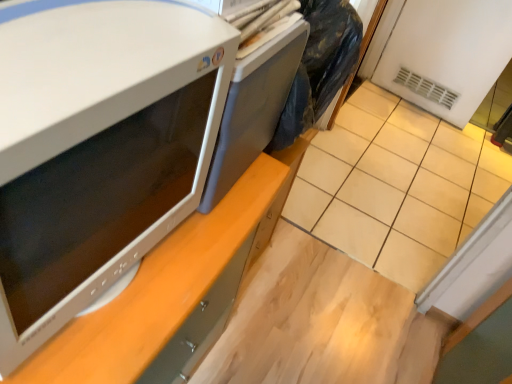
Question: From the image's perspective, is beige tile at lower right on white glossy microwave at left?

Choices:
 (A) no
 (B) yes

Answer: (B)

Question: Could white glossy microwave at left be considered to be inside beige tile at lower right?

Choices:
 (A) yes
 (B) no

Answer: (B)

Question: From a real-world perspective, is beige tile at lower right on top of white glossy microwave at left?

Choices:
 (A) yes
 (B) no

Answer: (B)

Question: Is beige tile at lower right at the left side of white glossy microwave at left?

Choices:
 (A) no
 (B) yes

Answer: (A)

Question: Is beige tile at lower right turned away from white glossy microwave at left?

Choices:
 (A) no
 (B) yes

Answer: (A)

Question: From the image's perspective, does beige tile at lower right appear lower than white glossy microwave at left?

Choices:
 (A) yes
 (B) no

Answer: (B)

Question: Could you tell me if white glossy microwave at left is turned towards beige tile at lower right?

Choices:
 (A) yes
 (B) no

Answer: (B)

Question: Is white glossy microwave at left next to beige tile at lower right?

Choices:
 (A) no
 (B) yes

Answer: (A)

Question: Is white glossy microwave at left bigger than beige tile at lower right?

Choices:
 (A) yes
 (B) no

Answer: (B)

Question: Is white glossy microwave at left taller than beige tile at lower right?

Choices:
 (A) yes
 (B) no

Answer: (B)

Question: Does white glossy microwave at left appear on the right side of beige tile at lower right?

Choices:
 (A) no
 (B) yes

Answer: (A)

Question: Is white glossy microwave at left further to the viewer compared to beige tile at lower right?

Choices:
 (A) no
 (B) yes

Answer: (A)

Question: From the image's perspective, is white glossy microwave at left on satin gray desktop at center?

Choices:
 (A) no
 (B) yes

Answer: (A)